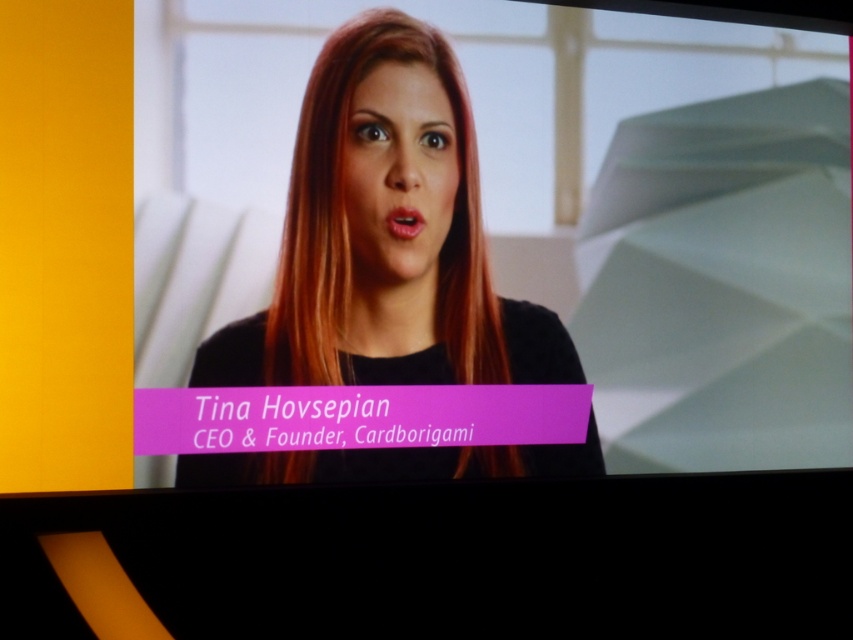
Question: Which of the following is the farthest from the observer?

Choices:
 (A) black matte hair at center
 (B) smooth skin face at center

Answer: (B)

Question: Which point is closer to the camera?

Choices:
 (A) (367, 204)
 (B) (370, 136)

Answer: (B)

Question: Does black matte hair at center have a smaller size compared to smooth skin face at center?

Choices:
 (A) yes
 (B) no

Answer: (B)

Question: Which point is closer to the camera taking this photo?

Choices:
 (A) (444, 138)
 (B) (305, 157)

Answer: (B)

Question: Is black matte hair at center in front of smooth skin face at center?

Choices:
 (A) yes
 (B) no

Answer: (A)

Question: Can you confirm if black matte hair at center is positioned below smooth skin face at center?

Choices:
 (A) yes
 (B) no

Answer: (A)